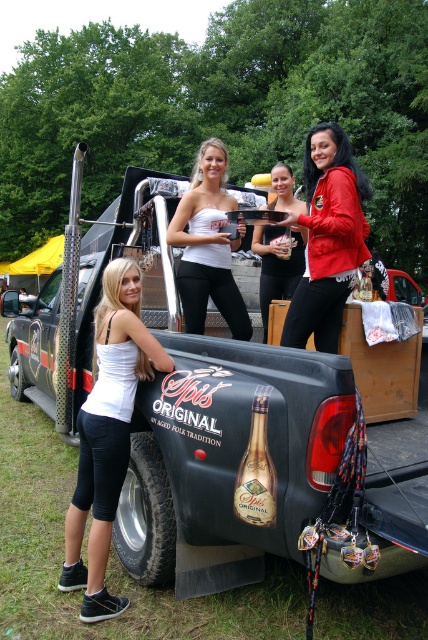
Who is higher up, black matte truck at center or matte black trophy at center?

Positioned higher is matte black trophy at center.

Which is more to the right, black matte truck at center or matte black trophy at center?

matte black trophy at center

Describe the element at coordinates (187, 408) in the screenshot. The image size is (428, 640). I see `black matte truck at center` at that location.

Where is `black matte truck at center`? black matte truck at center is located at coordinates (187, 408).

Who is more distant from viewer, (x=152, y=337) or (x=278, y=193)?

Positioned behind is point (x=278, y=193).

Does white fabric tank top at lower left appear over matte black trophy at center?

Actually, white fabric tank top at lower left is below matte black trophy at center.

Between point (118, 417) and point (279, 172), which one is positioned behind?

Point (279, 172)

This screenshot has width=428, height=640. What are the coordinates of `white fabric tank top at lower left` in the screenshot? It's located at (107, 433).

Does black matte truck at center have a greater height compared to red leather jacket at center?

No, black matte truck at center is not taller than red leather jacket at center.

Does black matte truck at center appear on the right side of red leather jacket at center?

Incorrect, black matte truck at center is not on the right side of red leather jacket at center.

Describe the element at coordinates (187, 408) in the screenshot. Image resolution: width=428 pixels, height=640 pixels. I see `black matte truck at center` at that location.

Find the location of `black matte truck at center`. black matte truck at center is located at coordinates (187, 408).